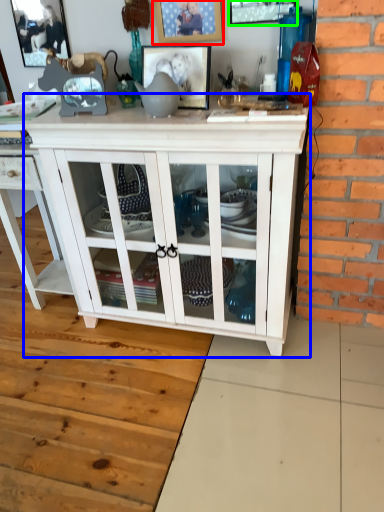
Question: Based on their relative distances, which object is farther from picture frame (highlighted by a red box)? Choose from cupboard (highlighted by a blue box) and picture frame (highlighted by a green box).

Choices:
 (A) cupboard
 (B) picture frame

Answer: (A)